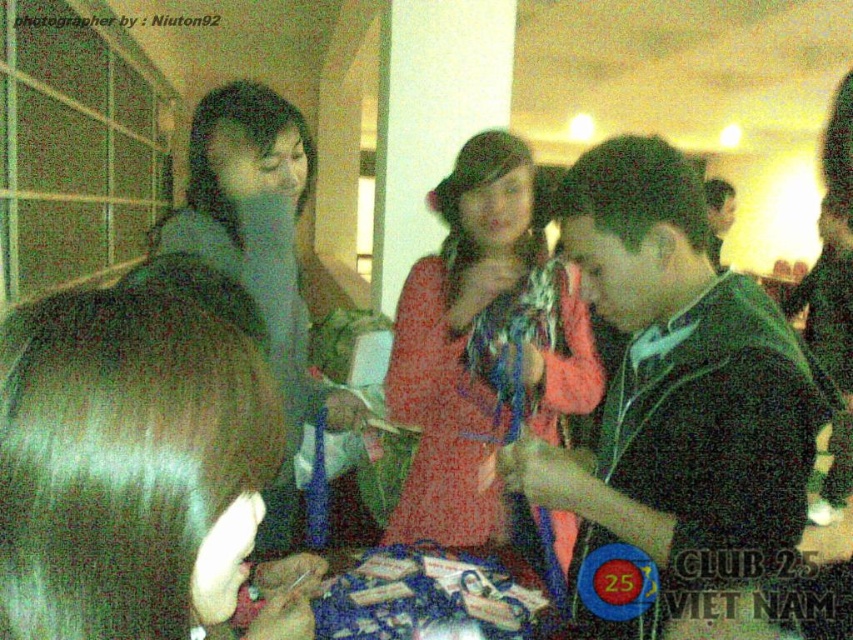
You are a photographer at the event and want to take a photo of the two people with the brown shiny hair at center and the matte gray hoodie at center. Which one should you focus on first if you want to capture both clearly?

The brown shiny hair at center is above the matte gray hoodie at center, so you should focus on the matte gray hoodie at center first as it is closer to the camera.

You are organizing a photo shoot and need to ensure that the two central outfits, the matte red dress at center and the matte gray hoodie at center, fit within a 1.5 meter wide backdrop. Based on the scene description, can both outfits fit side by side on the backdrop without overlapping?

The matte red dress at center is wider than the matte gray hoodie at center. However, since the exact widths are not provided, it is uncertain if their combined width exceeds 1.5 meters. Additional measurements are needed to confirm.